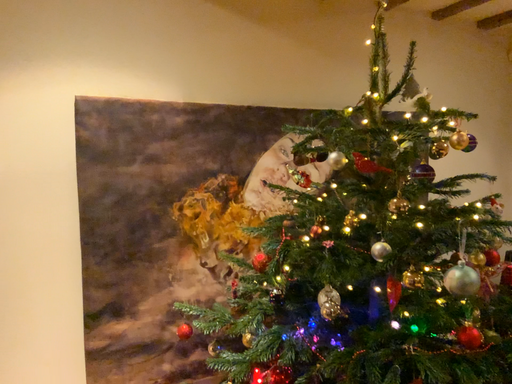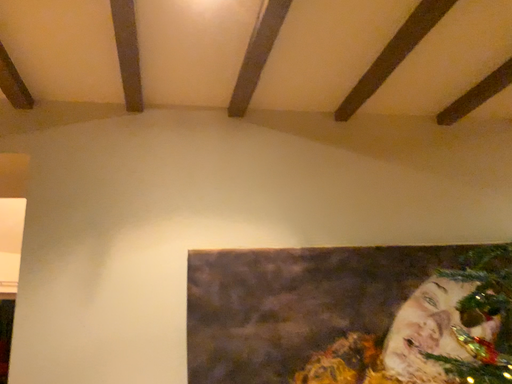
Question: How did the camera likely rotate when shooting the video?

Choices:
 (A) rotated downward
 (B) rotated upward

Answer: (B)